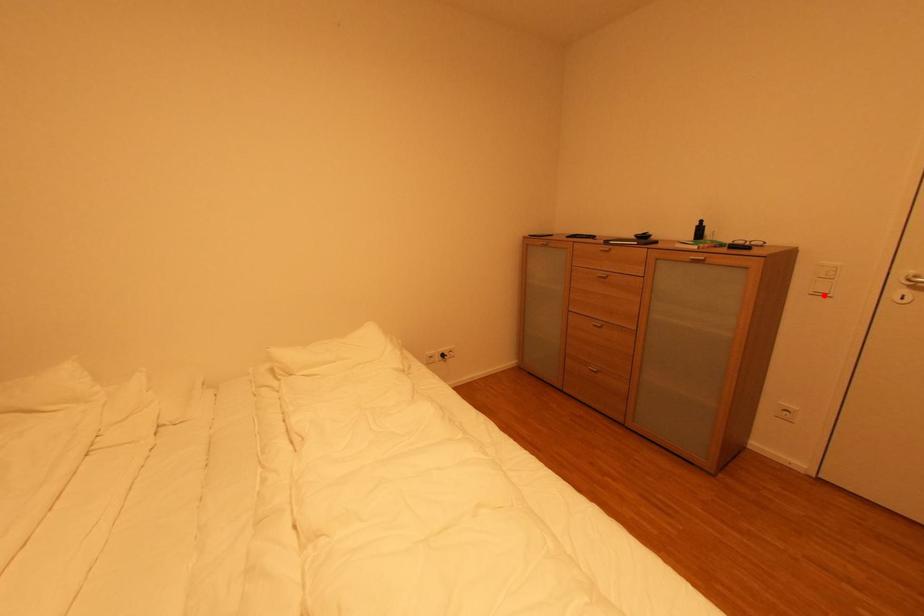
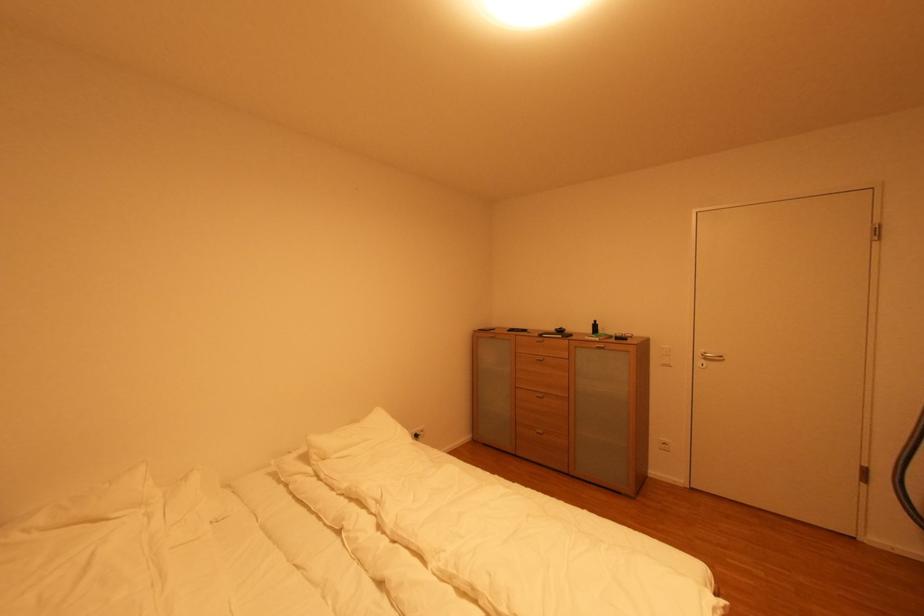
Find the pixel in the second image that matches the highlighted location in the first image.

(670, 367)